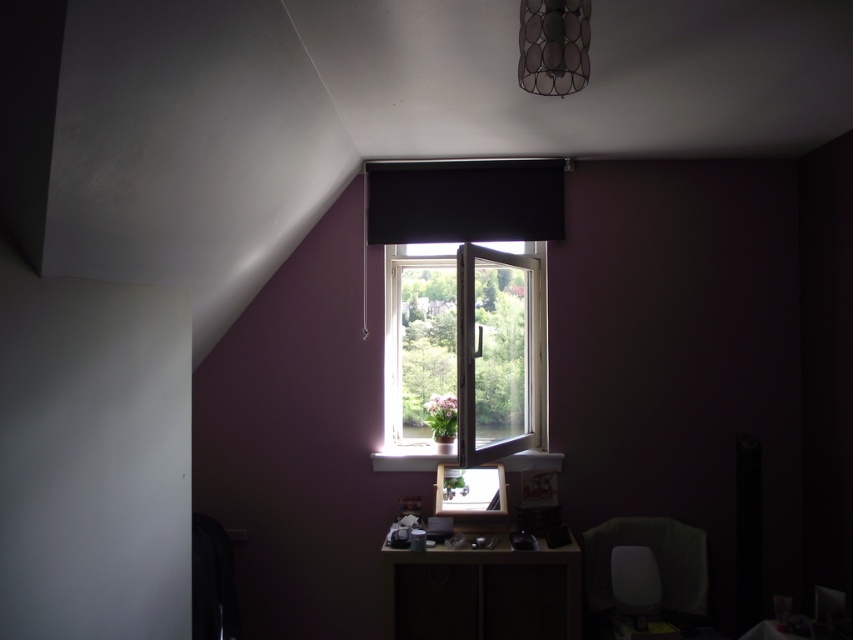
Can you confirm if velvet green chair at lower right is bigger than metallic wire mesh lampshade at upper center?

Correct, velvet green chair at lower right is larger in size than metallic wire mesh lampshade at upper center.

Measure the distance between point (x=700, y=536) and camera.

Point (x=700, y=536) is 11.28 feet from camera.

Who is more distant from viewer, (630, 516) or (589, 68)?

Point (630, 516)

This screenshot has height=640, width=853. Identify the location of velvet green chair at lower right. (654, 557).

Does metallic wire mesh lampshade at upper center appear on the right side of wooden at center?

Correct, you'll find metallic wire mesh lampshade at upper center to the right of wooden at center.

Is metallic wire mesh lampshade at upper center in front of wooden at center?

Yes, metallic wire mesh lampshade at upper center is in front of wooden at center.

Does point (538, 35) lie in front of point (432, 460)?

Yes, point (538, 35) is in front of point (432, 460).

Locate an element on the screen. This screenshot has height=640, width=853. metallic wire mesh lampshade at upper center is located at coordinates (553, 45).

Does point (448, 266) come closer to viewer compared to point (672, 531)?

No.

You are a GUI agent. You are given a task and a screenshot of the screen. Output one action in this format:
    pyautogui.click(x=<x>, y=<y>)
    Task: Click on the white plastic window at center
    The width and height of the screenshot is (853, 640).
    Given the screenshot: What is the action you would take?
    pyautogui.click(x=463, y=353)